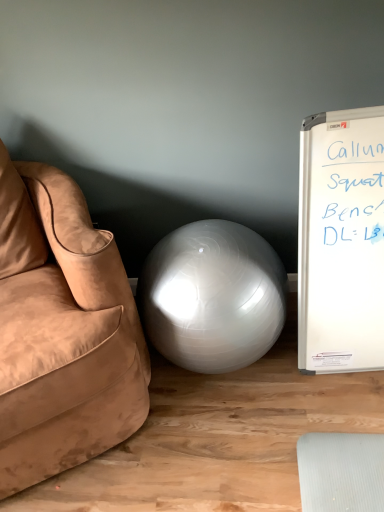
You are a GUI agent. You are given a task and a screenshot of the screen. Output one action in this format:
    pyautogui.click(x=<x>, y=<y>)
    Task: Click on the vacant space in front of satin white ball at center
    This screenshot has height=512, width=384.
    Given the screenshot: What is the action you would take?
    pyautogui.click(x=255, y=448)